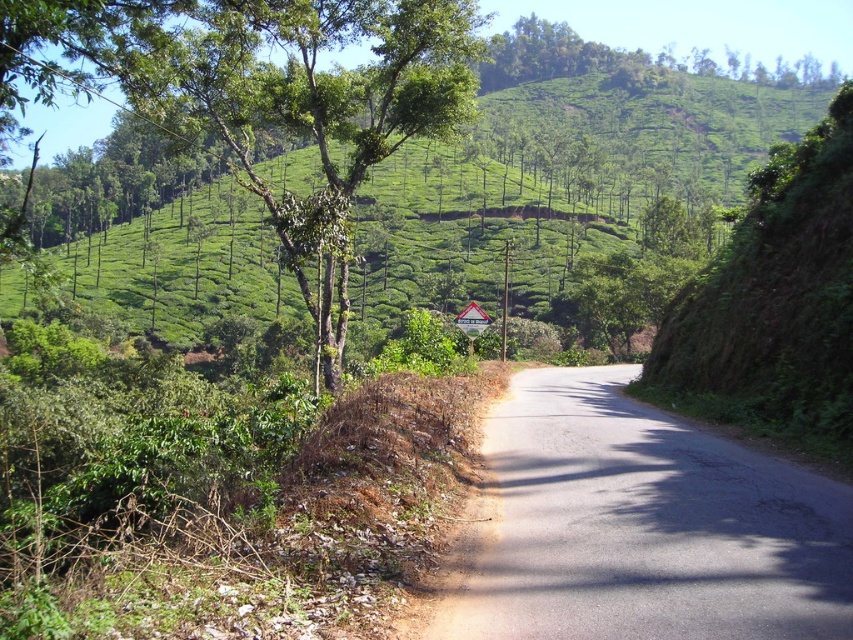
Question: Which point appears farthest from the camera in this image?

Choices:
 (A) (653, 612)
 (B) (212, 19)

Answer: (B)

Question: Does asphalt road at center have a smaller size compared to green leafy tree at upper center?

Choices:
 (A) no
 (B) yes

Answer: (B)

Question: Is asphalt road at center thinner than green leafy tree at upper center?

Choices:
 (A) no
 (B) yes

Answer: (B)

Question: Among these points, which one is nearest to the camera?

Choices:
 (A) (273, 118)
 (B) (579, 381)

Answer: (A)

Question: Does asphalt road at center appear on the right side of green leafy tree at upper center?

Choices:
 (A) no
 (B) yes

Answer: (B)

Question: Which object is closer to the camera taking this photo?

Choices:
 (A) asphalt road at center
 (B) green leafy tree at upper center

Answer: (A)